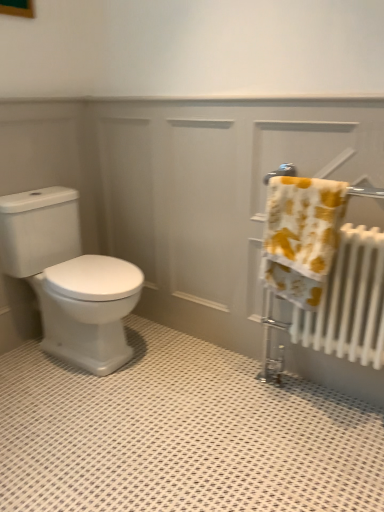
Image resolution: width=384 pixels, height=512 pixels. I want to click on free space in front of white glossy toilet at left, so click(x=76, y=416).